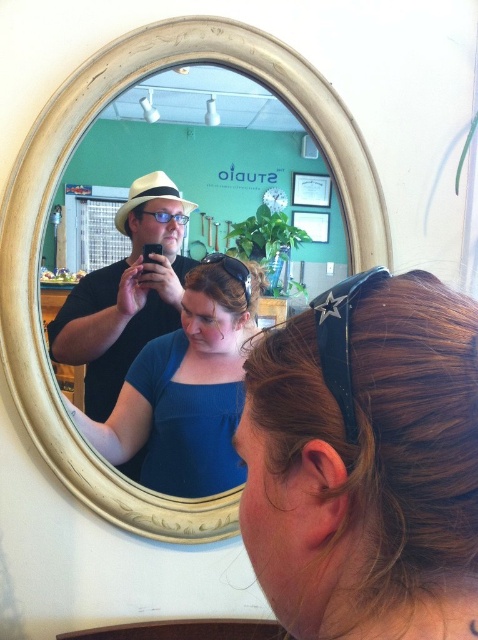
You are standing in the studio and looking at the mirror. You notice two points reflected in the mirror. The first point is at coordinate point (x=447, y=372) and the second is at point (x=89, y=148). Which point is closer to you in the reflection?

Point (x=447, y=372) is in front of point (x=89, y=148) in the mirror reflection, so it is closer to you.

You are standing in the studio and looking at the white wooden mirror at upper center. In the mirror, you see the brown hair at center. Based on the reflection, which side of the mirror is the person with brown hair located in real life?

The brown hair at center is to the right of the white wooden mirror at upper center in the reflection, so in real life, the person with brown hair is actually located to the left side of the mirror.